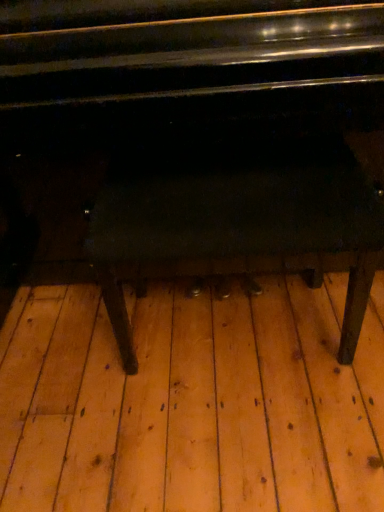
Describe the element at coordinates (210, 136) in the screenshot. I see `matte black table at center` at that location.

Identify the location of matte black table at center. This screenshot has height=512, width=384. (210, 136).

Where is `matte black table at center`? The width and height of the screenshot is (384, 512). matte black table at center is located at coordinates (210, 136).